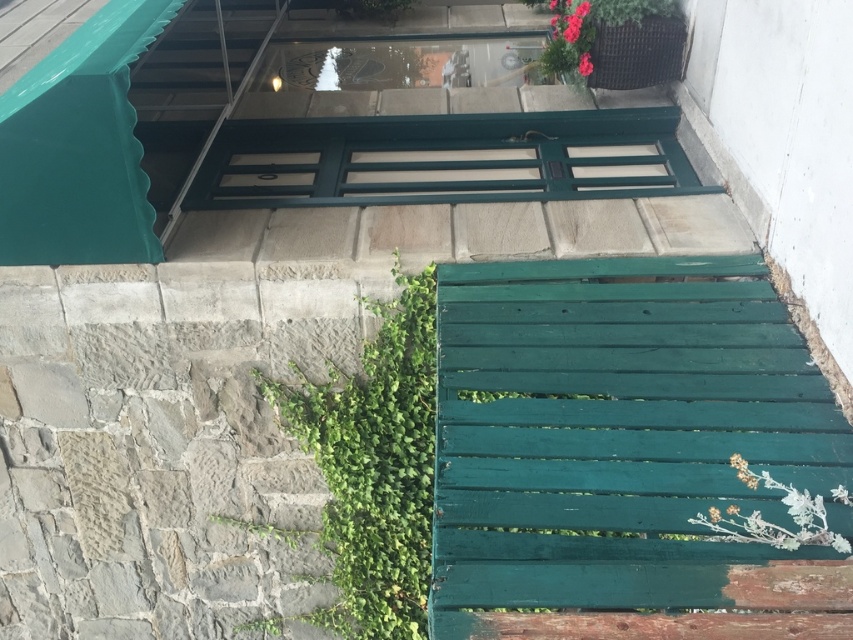
Can you confirm if green leafy plant at center is smaller than green wooden plant at lower right?

No.

This screenshot has height=640, width=853. What do you see at coordinates (374, 465) in the screenshot?
I see `green leafy plant at center` at bounding box center [374, 465].

Locate an element on the screen. This screenshot has height=640, width=853. green leafy plant at center is located at coordinates (374, 465).

Which is in front, point (640, 81) or point (556, 36)?

Positioned in front is point (640, 81).

The width and height of the screenshot is (853, 640). In order to click on matte black planter at upper right in this screenshot , I will do `click(614, 42)`.

Who is higher up, matte black planter at upper right or green leafy plant at lower left?

matte black planter at upper right is above.

Is point (556, 51) behind point (300, 529)?

Yes, point (556, 51) is farther from viewer.

Identify the location of matte black planter at upper right. This screenshot has width=853, height=640. (614, 42).